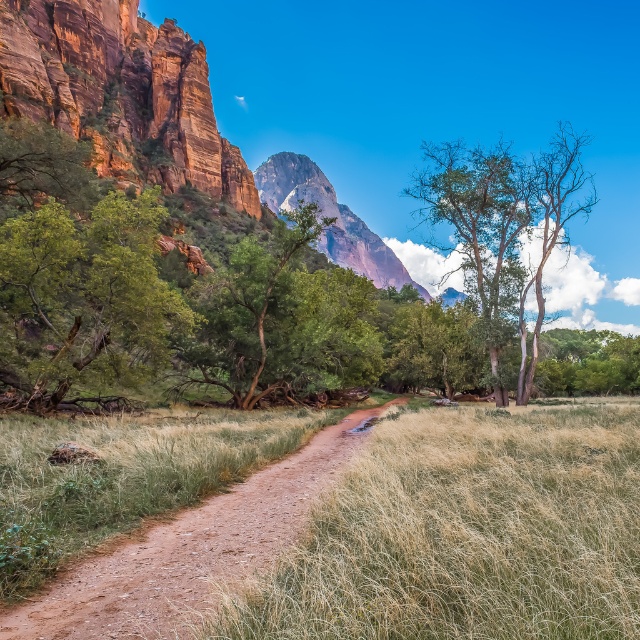
Question: Does green leafy tree at left have a smaller size compared to rustic stone mountain at center?

Choices:
 (A) yes
 (B) no

Answer: (A)

Question: Is green rough bark tree at center bigger than green matte tree at center?

Choices:
 (A) no
 (B) yes

Answer: (B)

Question: Which point is closer to the camera?

Choices:
 (A) (308, 464)
 (B) (253, 352)
 (C) (29, 296)

Answer: (A)

Question: Which object is farther from the camera taking this photo?

Choices:
 (A) dry grass at center
 (B) dirt path at center

Answer: (B)

Question: Considering the real-world distances, which object is farthest from the green matte tree at center?

Choices:
 (A) dry grass at center
 (B) green rough bark tree at center
 (C) green leafy tree at left
 (D) rustic stone mountain at center

Answer: (D)

Question: Can you confirm if green leafy tree at left is bigger than green rough bark tree at center?

Choices:
 (A) no
 (B) yes

Answer: (A)